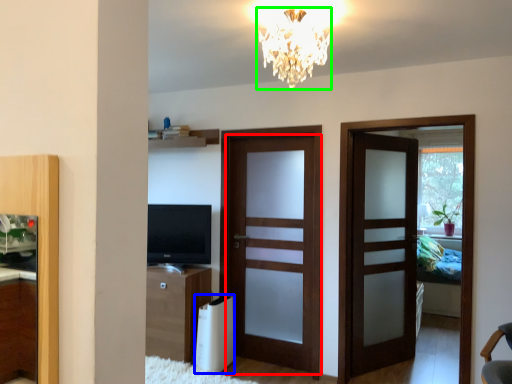
Question: Based on their relative distances, which object is farther from door (highlighted by a red box)? Choose from appliance (highlighted by a blue box) and lamp (highlighted by a green box).

Choices:
 (A) appliance
 (B) lamp

Answer: (B)